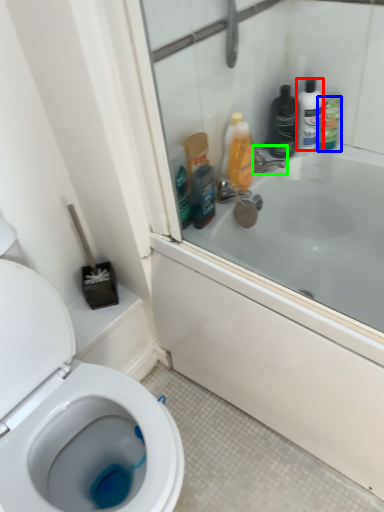
Question: Estimate the real-world distances between objects in this image. Which object is farther from toiletry (highlighted by a red box), cleaning product (highlighted by a blue box) or tap (highlighted by a green box)?

Choices:
 (A) cleaning product
 (B) tap

Answer: (B)